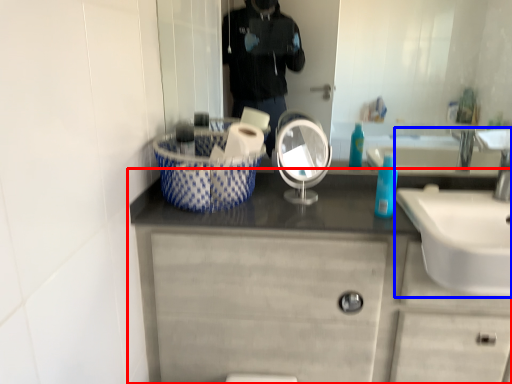
Question: Which object is closer to the camera taking this photo, bathroom cabinet (highlighted by a red box) or sink (highlighted by a blue box)?

Choices:
 (A) bathroom cabinet
 (B) sink

Answer: (B)